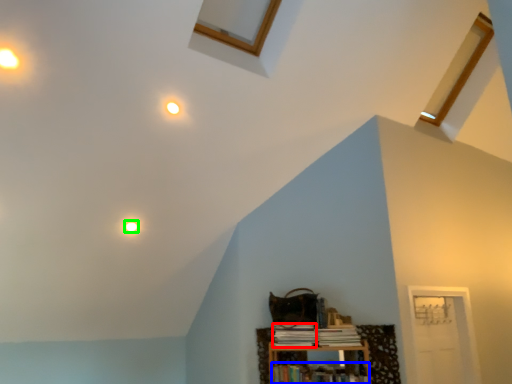
Question: Considering the real-world distances, which object is closest to book (highlighted by a red box)? book (highlighted by a blue box) or light (highlighted by a green box).

Choices:
 (A) book
 (B) light

Answer: (A)